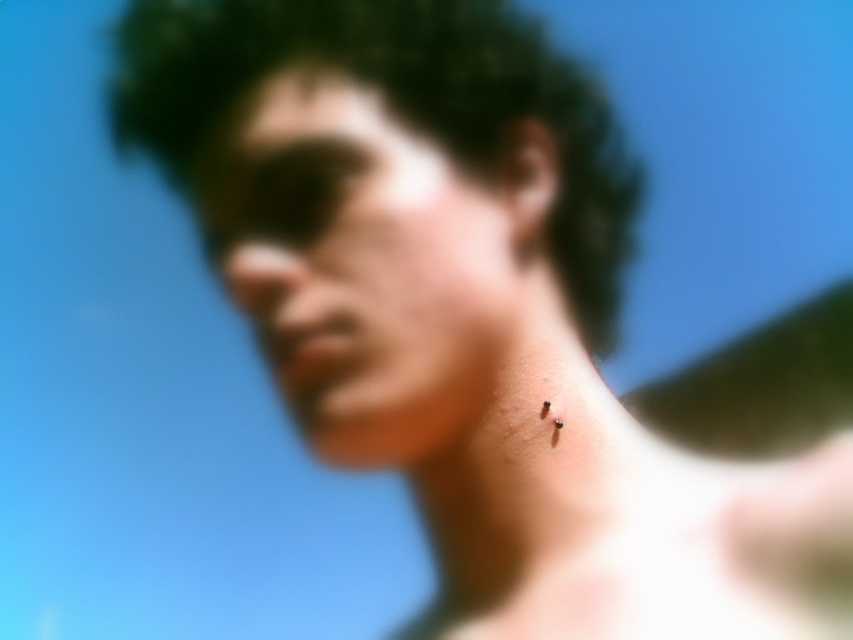
You are a photographer using a camera with a depth of field of 3 inches. You want to capture a portrait where both the smooth skin face at center and the dark curly hair at center are in focus. Based on the scene description, will both objects be in focus?

The smooth skin face at center is 2.77 inches away from dark curly hair at center. Since the depth of field is 3 inches, both objects will be within the focus range and thus in focus.

Looking at this image, you are a photographer analyzing this image. You notice two points in the scene at coordinates point (415, 285) and point (456, 45). Based on the depth of field, which point is more in focus?

Point (415, 285) is closer to the viewer than point (456, 45), so it is more in focus.